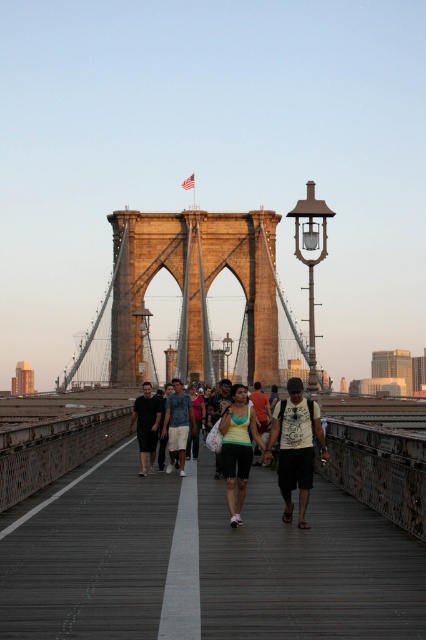
Question: Does brown stone bridge at center come behind black cotton shirt at center?

Choices:
 (A) yes
 (B) no

Answer: (B)

Question: Which point is farther to the camera?

Choices:
 (A) (244, 422)
 (B) (227, 422)
 (C) (290, 424)
 (D) (71, 371)

Answer: (D)

Question: Does light blue denim shorts at center appear on the left side of black cotton shirt at center?

Choices:
 (A) yes
 (B) no

Answer: (B)

Question: Which point is closer to the camera?

Choices:
 (A) black cotton shirt at center
 (B) wooden bridge at center

Answer: (B)

Question: Is matte green shirt at center further to the viewer compared to matte yellow-green tank top at center?

Choices:
 (A) no
 (B) yes

Answer: (A)

Question: Estimate the real-world distances between objects in this image. Which object is closer to the matte green shirt at center?

Choices:
 (A) black cotton shirt at center
 (B) light blue denim shorts at center

Answer: (B)